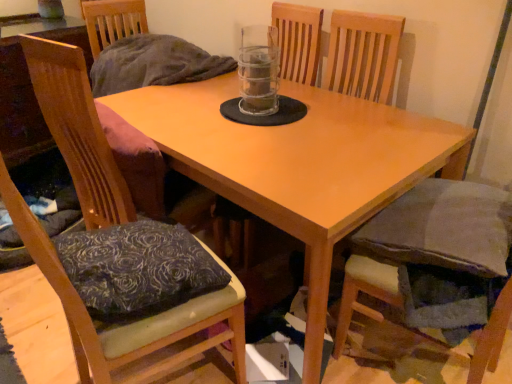
Question: Considering the positions of wooden cushioned chair at left, which ranks as the second chair in right-to-left order, and velvet gray cushion at lower right, the 2th chair viewed from the left, in the image, is wooden cushioned chair at left, which ranks as the second chair in right-to-left order, taller or shorter than velvet gray cushion at lower right, the 2th chair viewed from the left,?

Choices:
 (A) tall
 (B) short

Answer: (A)

Question: Is wooden cushioned chair at left, which ranks as the second chair in right-to-left order, inside or outside of velvet gray cushion at lower right, the first chair when ordered from right to left?

Choices:
 (A) inside
 (B) outside

Answer: (B)

Question: Which of these objects is positioned farthest from the satin dark blue pillow at lower left?

Choices:
 (A) light brown wooden table at center
 (B) velvet gray cushion at lower right, the 2th chair viewed from the left
 (C) transparent plastic beverage at center
 (D) wooden cushioned chair at left, the first chair viewed from the left

Answer: (C)

Question: Which of these objects is positioned closest to the velvet gray cushion at lower right, the first chair when ordered from right to left?

Choices:
 (A) transparent plastic beverage at center
 (B) satin dark blue pillow at lower left
 (C) wooden cushioned chair at left, which ranks as the second chair in right-to-left order
 (D) light brown wooden table at center

Answer: (D)